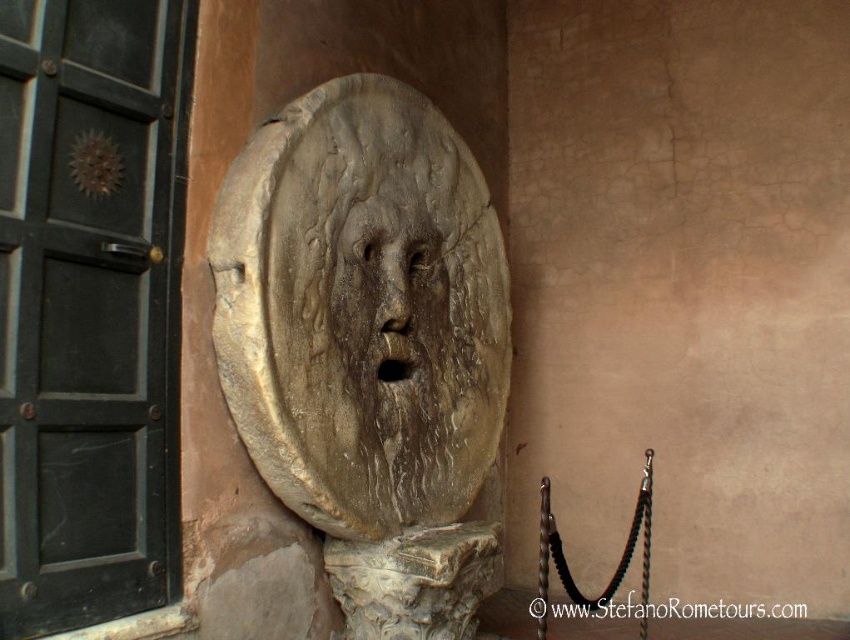
You are standing in front of the sculpture and want to touch both the brown stone mask at center and the rough stone face at center. Which one can you reach first without moving your position?

The brown stone mask at center is closer to the viewer than the rough stone face at center, so you can reach it first without moving your position.

You are an art restorer assessing the dimensions of the sculpture. The brown stone mask at center and the rough stone face at center are both part of the same sculpture. Which part has a greater width?

The brown stone mask at center has a greater width than the rough stone face at center as stated in the description.

You are standing in front of the sculpture called The Mouth of Truth. There is a point marked at coordinates (369,346). What does this point indicate?

The point marked at coordinates (369,346) indicates the location of the brown stone mask at center.